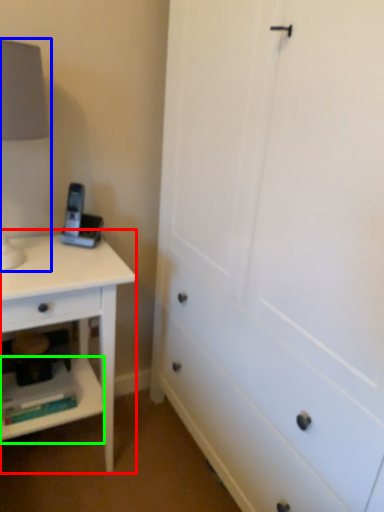
Question: Estimate the real-world distances between objects in this image. Which object is farther from nightstand (highlighted by a red box), table lamp (highlighted by a blue box) or shelf (highlighted by a green box)?

Choices:
 (A) table lamp
 (B) shelf

Answer: (A)